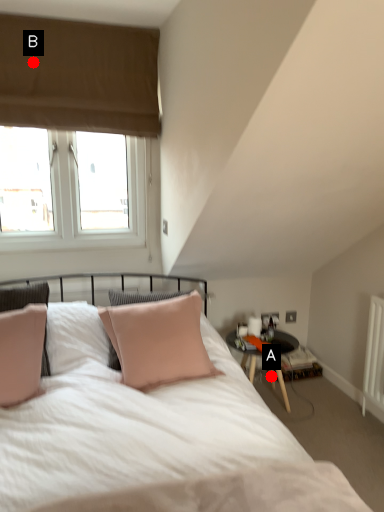
Question: Two points are circled on the image, labeled by A and B beside each circle. Which point is farther from the camera taking this photo?

Choices:
 (A) A is further
 (B) B is further

Answer: (A)